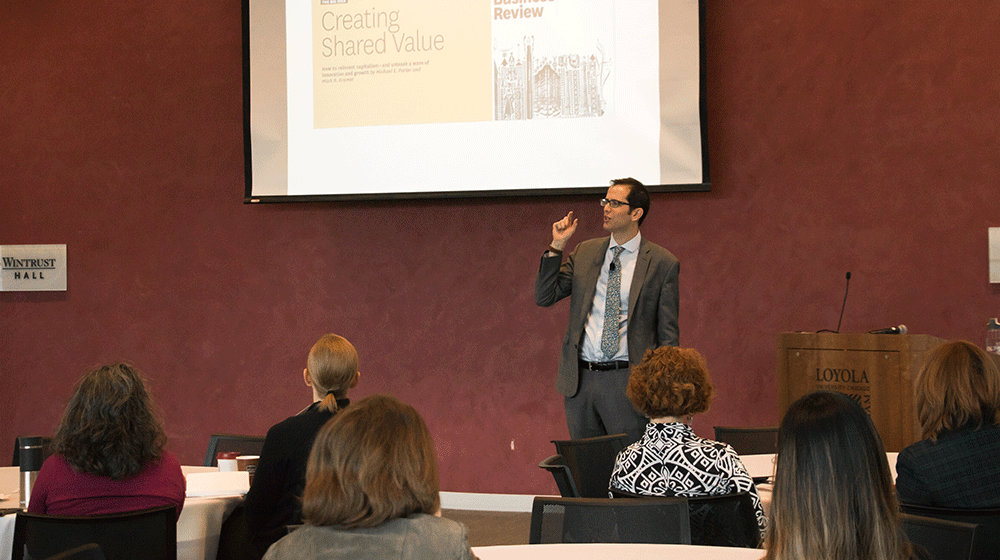
Locate an element on the screen. This screenshot has width=1000, height=560. burgundy wall is located at coordinates (457, 284).